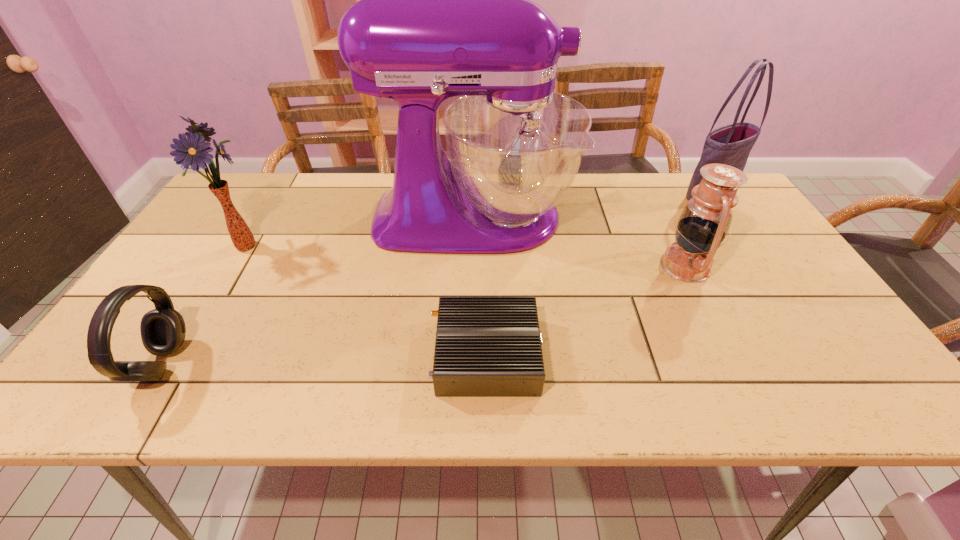
Find the location of `the tallest object`. the tallest object is located at coordinates (445, 9).

The height and width of the screenshot is (540, 960). I want to click on the rightmost object, so click(x=731, y=144).

The width and height of the screenshot is (960, 540). What are the coordinates of `flower arrangement` in the screenshot? It's located at (193, 151).

This screenshot has width=960, height=540. I want to click on the second object from right to left, so click(705, 221).

Find the location of `the third shortest object`. the third shortest object is located at coordinates (705, 221).

I want to click on the fifth tallest object, so click(x=162, y=329).

Image resolution: width=960 pixels, height=540 pixels. Identify the location of router. (485, 346).

Find the location of a particular element. Image resolution: width=960 pixels, height=540 pixels. blank area located at the bowl opening of the mixer is located at coordinates (664, 218).

Where is `vacant space located 0.290m on the left of the tote bag`? The width and height of the screenshot is (960, 540). vacant space located 0.290m on the left of the tote bag is located at coordinates (589, 195).

Identify the location of vacant point located on the right of the flower arrangement. The height and width of the screenshot is (540, 960). (286, 245).